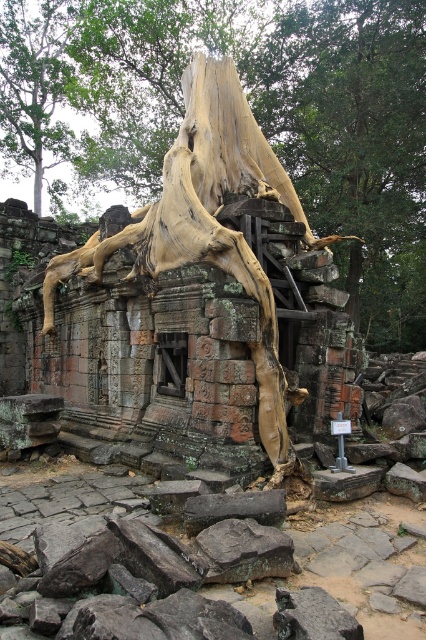
Which of these two, light brown bark tree trunk at center or smooth gray rock at center, stands taller?

light brown bark tree trunk at center is taller.

Does point (393, 154) come behind point (284, 576)?

Yes, point (393, 154) is behind point (284, 576).

Identify the location of light brown bark tree trunk at center. (354, 141).